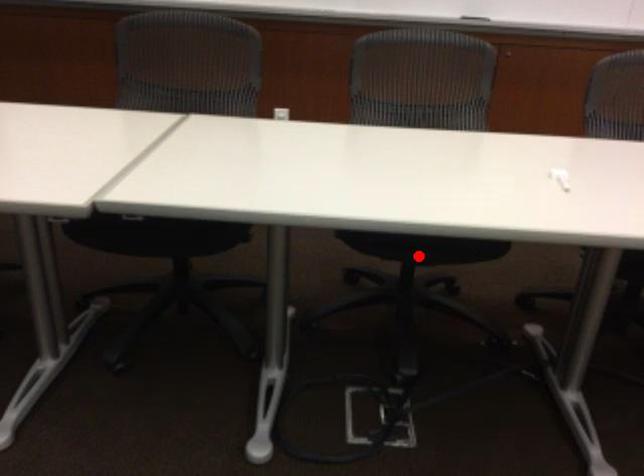
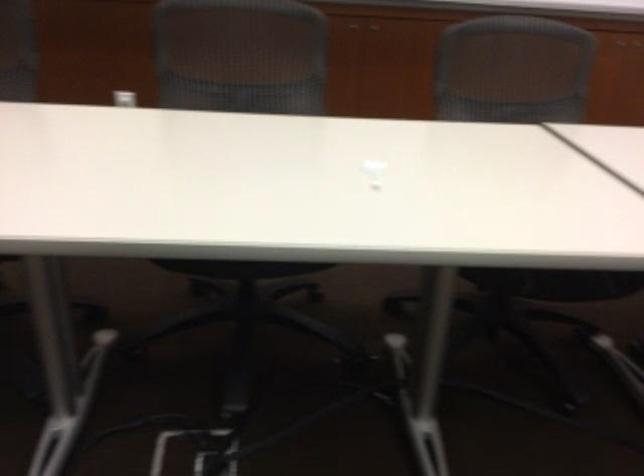
Find the pixel in the second image that matches the highlighted location in the first image.

(239, 268)